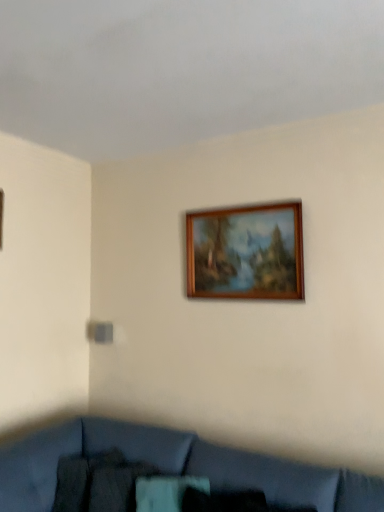
Image resolution: width=384 pixels, height=512 pixels. What do you see at coordinates (246, 252) in the screenshot?
I see `wooden picture frame at upper center` at bounding box center [246, 252].

You are a GUI agent. You are given a task and a screenshot of the screen. Output one action in this format:
    pyautogui.click(x=<x>, y=<y>)
    Task: Click on the wooden picture frame at upper center
    Image resolution: width=384 pixels, height=512 pixels.
    Given the screenshot: What is the action you would take?
    pyautogui.click(x=246, y=252)

In order to face wooden picture frame at upper center, should I rotate leftwards or rightwards?

You should rotate right by 6.567 degrees.

What is the approximate width of velvet blue couch at lower center?

1.28 meters.

What do you see at coordinates (175, 467) in the screenshot? I see `velvet blue couch at lower center` at bounding box center [175, 467].

Locate an element on the screen. velvet blue couch at lower center is located at coordinates (175, 467).

Locate an element on the screen. Image resolution: width=384 pixels, height=512 pixels. wooden picture frame at upper center is located at coordinates (246, 252).

Is velvet blue couch at lower center to the left of wooden picture frame at upper center from the viewer's perspective?

Yes.

Relative to wooden picture frame at upper center, is velvet blue couch at lower center in front or behind?

Visually, velvet blue couch at lower center is located in front of wooden picture frame at upper center.

Which is closer, (285, 465) or (240, 262)?

Point (285, 465) is positioned closer to the camera compared to point (240, 262).

From the image's perspective, relative to wooden picture frame at upper center, is velvet blue couch at lower center above or below?

From the image's perspective, velvet blue couch at lower center appears below wooden picture frame at upper center.

From a real-world perspective, is velvet blue couch at lower center physically above wooden picture frame at upper center?

No, from a real-world perspective, velvet blue couch at lower center is not over wooden picture frame at upper center

Can you confirm if velvet blue couch at lower center is thinner than wooden picture frame at upper center?

No, velvet blue couch at lower center is not thinner than wooden picture frame at upper center.

Between velvet blue couch at lower center and wooden picture frame at upper center, which one has more height?

velvet blue couch at lower center is taller.

Considering the relative sizes of velvet blue couch at lower center and wooden picture frame at upper center in the image provided, is velvet blue couch at lower center smaller than wooden picture frame at upper center?

Actually, velvet blue couch at lower center might be larger than wooden picture frame at upper center.

Which is correct: velvet blue couch at lower center is inside wooden picture frame at upper center, or outside of it?

The correct answer is: outside.

Is velvet blue couch at lower center not near wooden picture frame at upper center?

Yes, velvet blue couch at lower center and wooden picture frame at upper center are quite far apart.

Is velvet blue couch at lower center looking in the opposite direction of wooden picture frame at upper center?

velvet blue couch at lower center does not have its back to wooden picture frame at upper center.

What are the coordinates of `studio couch below the wooden picture frame at upper center (from a real-world perspective)` in the screenshot? It's located at (175, 467).

Which is more to the left, wooden picture frame at upper center or velvet blue couch at lower center?

velvet blue couch at lower center is more to the left.

Is the position of wooden picture frame at upper center less distant than that of velvet blue couch at lower center?

No, it is not.

Is point (274, 283) closer or farther from the camera than point (336, 470)?

Point (274, 283) is positioned farther from the camera compared to point (336, 470).

From the image's perspective, which is below, wooden picture frame at upper center or velvet blue couch at lower center?

From the image's view, velvet blue couch at lower center is below.

Based on the photo, from a real-world perspective, which object stands above the other?

wooden picture frame at upper center, from a real-world perspective.

Considering the sizes of objects wooden picture frame at upper center and velvet blue couch at lower center in the image provided, who is wider, wooden picture frame at upper center or velvet blue couch at lower center?

velvet blue couch at lower center is wider.

Which of these two, wooden picture frame at upper center or velvet blue couch at lower center, stands taller?

velvet blue couch at lower center.

Considering the relative sizes of wooden picture frame at upper center and velvet blue couch at lower center in the image provided, is wooden picture frame at upper center smaller than velvet blue couch at lower center?

Indeed, wooden picture frame at upper center has a smaller size compared to velvet blue couch at lower center.

Is wooden picture frame at upper center located outside velvet blue couch at lower center?

wooden picture frame at upper center is positioned outside velvet blue couch at lower center.

Is wooden picture frame at upper center with velvet blue couch at lower center?

No, wooden picture frame at upper center is not next to velvet blue couch at lower center.

Is wooden picture frame at upper center oriented away from velvet blue couch at lower center?

No, velvet blue couch at lower center is not at the back of wooden picture frame at upper center.

How many degrees apart are the facing directions of wooden picture frame at upper center and velvet blue couch at lower center?

2.26 degrees separate the facing orientations of wooden picture frame at upper center and velvet blue couch at lower center.

Find the location of a particular element. The image size is (384, 512). picture frame behind the velvet blue couch at lower center is located at coordinates (246, 252).

I want to click on picture frame positioned vertically above the velvet blue couch at lower center (from a real-world perspective), so click(x=246, y=252).

The image size is (384, 512). In order to click on studio couch directly beneath the wooden picture frame at upper center (from a real-world perspective) in this screenshot , I will do `click(175, 467)`.